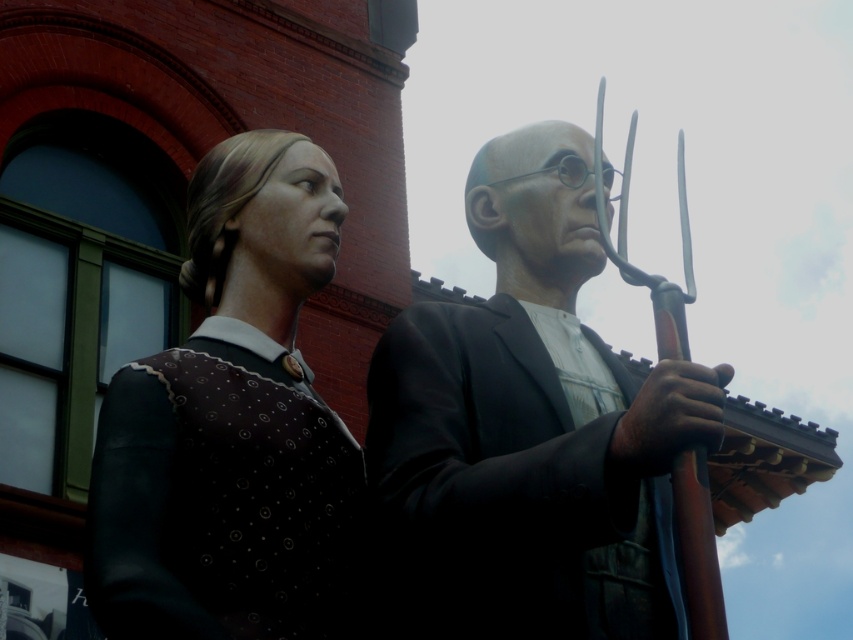
You are an art critic standing at a certain distance from the matte black suit at center. If you want to get a closer look without moving, what can you do?

Since the matte black suit at center is 26.97 meters away from the viewer, you can use a zoom lens or binoculars to get a closer look without moving.

You are an art curator planning to move the matte brown vest at left closer to the matte black suit at center. Currently, how far apart are these two sculptures?

The matte black suit at center is 3.72 meters away from the matte brown vest at left, so the distance between them is 3.72 meters.

Consider the image. You are an art curator planning to move the matte black suit at center and the matte brown vest at left closer together. Given their widths, which sculpture should you move first to ensure they can fit side by side without overlapping?

The matte black suit at center is wider than the matte brown vest at left, so you should move the matte brown vest at left first to accommodate the wider matte black suit at center.